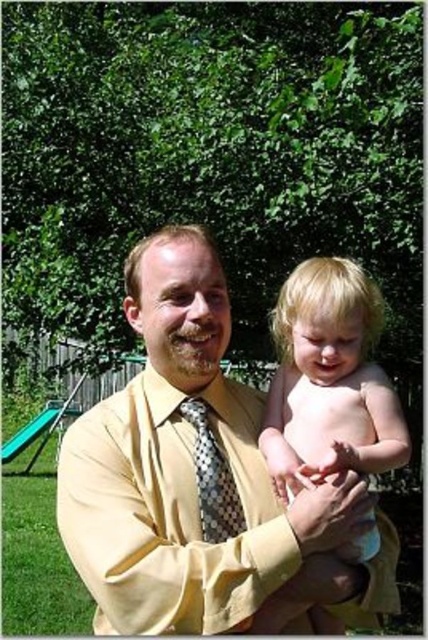
Consider the image. You are a photographer trying to capture the perfect shot of the blonde hair at center and the polka dot silk tie at center. Since you want to focus on the details of both objects, which one should you zoom in on more to ensure clarity?

The polka dot silk tie at center should be zoomed in on more because it is smaller in size compared to the blonde hair at center, ensuring both objects are captured with equal clarity.

You are a photographer trying to capture a closeup shot of the yellow satin shirt at center and the blonde hair at center. The camera you are using has a maximum focus range of 10 inches. Can you fit both subjects within the focus range?

The yellow satin shirt at center and blonde hair at center are 10.04 inches apart from each other. Since the distance between them exceeds the camera focus range of 10 inches, you cannot fit both subjects within the focus range.